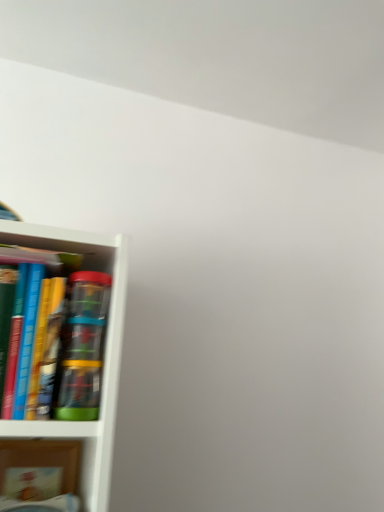
This screenshot has height=512, width=384. Find the location of `matte cardboard book at lower left, which is the second book from top to bottom`. matte cardboard book at lower left, which is the second book from top to bottom is located at coordinates (39, 475).

This screenshot has width=384, height=512. What do you see at coordinates (39, 475) in the screenshot? I see `matte cardboard book at lower left, which is the second book from top to bottom` at bounding box center [39, 475].

Measure the distance between point (49, 290) and camera.

Point (49, 290) and camera are 23.54 inches apart.

In order to click on hardcover book at left, which is the second book in bottom-to-top order in this screenshot , I will do `click(31, 326)`.

This screenshot has height=512, width=384. What do you see at coordinates (31, 326) in the screenshot?
I see `hardcover book at left, which is the second book in bottom-to-top order` at bounding box center [31, 326].

The image size is (384, 512). Find the location of `matte cardboard book at lower left, positioned as the first book in bottom-to-top order`. matte cardboard book at lower left, positioned as the first book in bottom-to-top order is located at coordinates (39, 475).

Is matte cardboard book at lower left, positioned as the first book in bottom-to-top order, to the right of hardcover book at left, the first book when ordered from top to bottom, from the viewer's perspective?

In fact, matte cardboard book at lower left, positioned as the first book in bottom-to-top order, is to the left of hardcover book at left, the first book when ordered from top to bottom.

Considering the positions of objects matte cardboard book at lower left, which is the second book from top to bottom, and hardcover book at left, which is the second book in bottom-to-top order, in the image provided, who is in front, matte cardboard book at lower left, which is the second book from top to bottom, or hardcover book at left, which is the second book in bottom-to-top order,?

hardcover book at left, which is the second book in bottom-to-top order, is more forward.

Which is farther from the camera, (34, 459) or (19, 256)?

The point (34, 459) is farther.

From the image's perspective, is matte cardboard book at lower left, which is the second book from top to bottom, above hardcover book at left, the first book when ordered from top to bottom?

Actually, matte cardboard book at lower left, which is the second book from top to bottom, appears below hardcover book at left, the first book when ordered from top to bottom, in the image.

From a real-world perspective, which object stands above the other?

hardcover book at left, which is the second book in bottom-to-top order.

Looking at their sizes, would you say matte cardboard book at lower left, positioned as the first book in bottom-to-top order, is wider or thinner than hardcover book at left, which is the second book in bottom-to-top order?

Considering their sizes, matte cardboard book at lower left, positioned as the first book in bottom-to-top order, looks slimmer than hardcover book at left, which is the second book in bottom-to-top order.

Based on the photo, is matte cardboard book at lower left, positioned as the first book in bottom-to-top order, taller or shorter than hardcover book at left, the first book when ordered from top to bottom?

Considering their sizes, matte cardboard book at lower left, positioned as the first book in bottom-to-top order, has less height than hardcover book at left, the first book when ordered from top to bottom.

Looking at the image, does matte cardboard book at lower left, positioned as the first book in bottom-to-top order, seem bigger or smaller compared to hardcover book at left, which is the second book in bottom-to-top order?

Considering their sizes, matte cardboard book at lower left, positioned as the first book in bottom-to-top order, takes up less space than hardcover book at left, which is the second book in bottom-to-top order.

Is matte cardboard book at lower left, positioned as the first book in bottom-to-top order, outside of hardcover book at left, which is the second book in bottom-to-top order?

Yes, matte cardboard book at lower left, positioned as the first book in bottom-to-top order, is located beyond the bounds of hardcover book at left, which is the second book in bottom-to-top order.

Are matte cardboard book at lower left, which is the second book from top to bottom, and hardcover book at left, which is the second book in bottom-to-top order, located far from each other?

No, matte cardboard book at lower left, which is the second book from top to bottom, is in close proximity to hardcover book at left, which is the second book in bottom-to-top order.

Is matte cardboard book at lower left, positioned as the first book in bottom-to-top order, aimed at hardcover book at left, which is the second book in bottom-to-top order?

No, matte cardboard book at lower left, positioned as the first book in bottom-to-top order, is not turned towards hardcover book at left, which is the second book in bottom-to-top order.

How much distance is there between matte cardboard book at lower left, which is the second book from top to bottom, and hardcover book at left, which is the second book in bottom-to-top order?

matte cardboard book at lower left, which is the second book from top to bottom, is 11.31 inches from hardcover book at left, which is the second book in bottom-to-top order.

There is a matte cardboard book at lower left, positioned as the first book in bottom-to-top order. Identify the location of book above it (from a real-world perspective). Image resolution: width=384 pixels, height=512 pixels. (x=31, y=326).

Between hardcover book at left, which is the second book in bottom-to-top order, and matte cardboard book at lower left, which is the second book from top to bottom, which one appears on the left side from the viewer's perspective?

matte cardboard book at lower left, which is the second book from top to bottom, is more to the left.

Is the depth of hardcover book at left, the first book when ordered from top to bottom, less than that of matte cardboard book at lower left, positioned as the first book in bottom-to-top order?

Yes, hardcover book at left, the first book when ordered from top to bottom, is closer to the camera.

Does point (30, 395) come behind point (26, 444)?

No.

From the image's perspective, is hardcover book at left, the first book when ordered from top to bottom, above or below matte cardboard book at lower left, which is the second book from top to bottom?

From the image's perspective, hardcover book at left, the first book when ordered from top to bottom, appears above matte cardboard book at lower left, which is the second book from top to bottom.

From a real-world perspective, is hardcover book at left, the first book when ordered from top to bottom, located beneath matte cardboard book at lower left, which is the second book from top to bottom?

No, from a real-world perspective, hardcover book at left, the first book when ordered from top to bottom, is not under matte cardboard book at lower left, which is the second book from top to bottom.

Can you confirm if hardcover book at left, the first book when ordered from top to bottom, is wider than matte cardboard book at lower left, which is the second book from top to bottom?

Correct, the width of hardcover book at left, the first book when ordered from top to bottom, exceeds that of matte cardboard book at lower left, which is the second book from top to bottom.

Can you confirm if hardcover book at left, which is the second book in bottom-to-top order, is shorter than matte cardboard book at lower left, positioned as the first book in bottom-to-top order?

No.

Considering the relative sizes of hardcover book at left, the first book when ordered from top to bottom, and matte cardboard book at lower left, positioned as the first book in bottom-to-top order, in the image provided, is hardcover book at left, the first book when ordered from top to bottom, bigger than matte cardboard book at lower left, positioned as the first book in bottom-to-top order,?

Indeed, hardcover book at left, the first book when ordered from top to bottom, has a larger size compared to matte cardboard book at lower left, positioned as the first book in bottom-to-top order.

Is hardcover book at left, the first book when ordered from top to bottom, outside of matte cardboard book at lower left, positioned as the first book in bottom-to-top order?

Indeed, hardcover book at left, the first book when ordered from top to bottom, is completely outside matte cardboard book at lower left, positioned as the first book in bottom-to-top order.

Is hardcover book at left, which is the second book in bottom-to-top order, not close to matte cardboard book at lower left, positioned as the first book in bottom-to-top order?

No.

Is matte cardboard book at lower left, which is the second book from top to bottom, at the back of hardcover book at left, the first book when ordered from top to bottom?

No, hardcover book at left, the first book when ordered from top to bottom, is not facing the opposite direction of matte cardboard book at lower left, which is the second book from top to bottom.

The height and width of the screenshot is (512, 384). Find the location of `book that appears below the hardcover book at left, which is the second book in bottom-to-top order (from the image's perspective)`. book that appears below the hardcover book at left, which is the second book in bottom-to-top order (from the image's perspective) is located at coordinates (39, 475).

In the image, there is a hardcover book at left, which is the second book in bottom-to-top order. In order to click on book below it (from a real-world perspective) in this screenshot , I will do `click(39, 475)`.

Where is `book below the hardcover book at left, which is the second book in bottom-to-top order (from the image's perspective)`? book below the hardcover book at left, which is the second book in bottom-to-top order (from the image's perspective) is located at coordinates (39, 475).